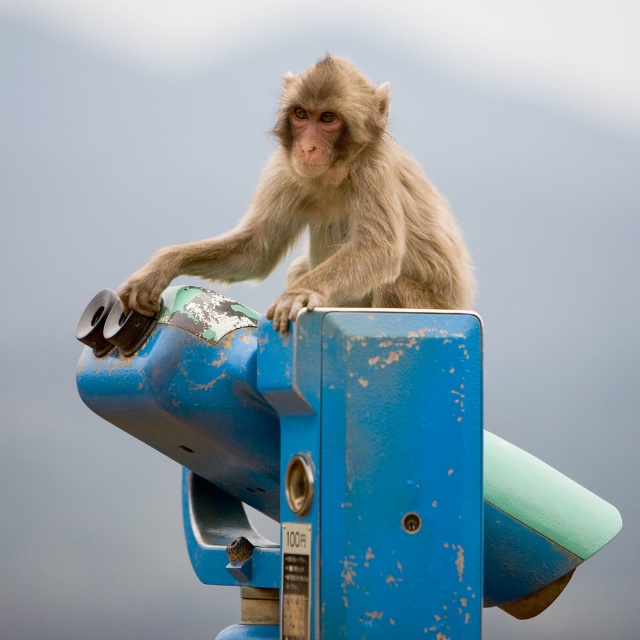
From the picture: Who is shorter, blue matte/rough telescope at upper center or fuzzy beige monkey at center?

fuzzy beige monkey at center

Which of these two, blue matte/rough telescope at upper center or fuzzy beige monkey at center, stands taller?

blue matte/rough telescope at upper center

Identify the location of blue matte/rough telescope at upper center. The image size is (640, 640). (342, 461).